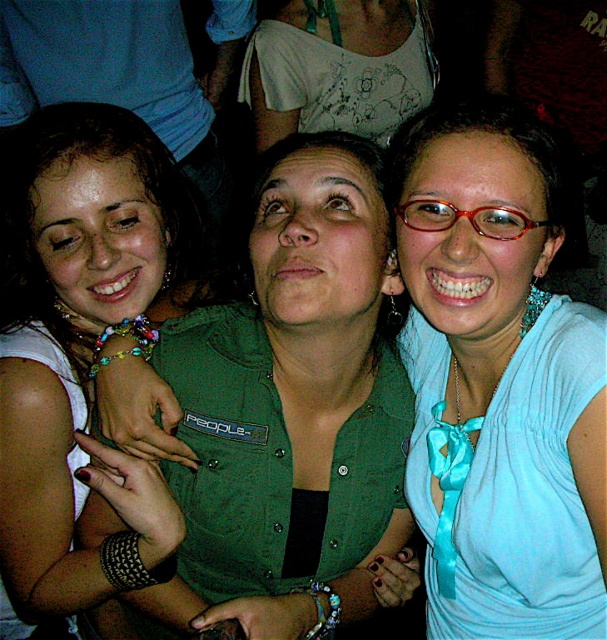
Which is behind, point (458, 314) or point (50, 340)?

Point (50, 340)

Who is taller, matte blue blouse at center or matte green shirt at center?

Standing taller between the two is matte green shirt at center.

Is point (557, 321) closer to viewer compared to point (49, 461)?

Yes, it is.

In order to click on matte blue blouse at center in this screenshot , I will do `click(497, 381)`.

Between point (571, 600) and point (449, 456), which one is positioned in front?

Point (571, 600)

Which is more to the right, matte blue blouse at center or teal satin ribbon at lower right?

matte blue blouse at center

This screenshot has width=607, height=640. Describe the element at coordinates (497, 381) in the screenshot. I see `matte blue blouse at center` at that location.

What are the coordinates of `matte blue blouse at center` in the screenshot? It's located at (497, 381).

Between teal satin ribbon at lower right and translucent red glasses at center, which one has less height?

translucent red glasses at center is shorter.

Is teal satin ribbon at lower right shorter than translucent red glasses at center?

No.

Between point (443, 497) and point (543, 220), which one is positioned behind?

The point (443, 497) is more distant.

This screenshot has width=607, height=640. Find the location of `teal satin ribbon at lower right`. teal satin ribbon at lower right is located at coordinates (449, 486).